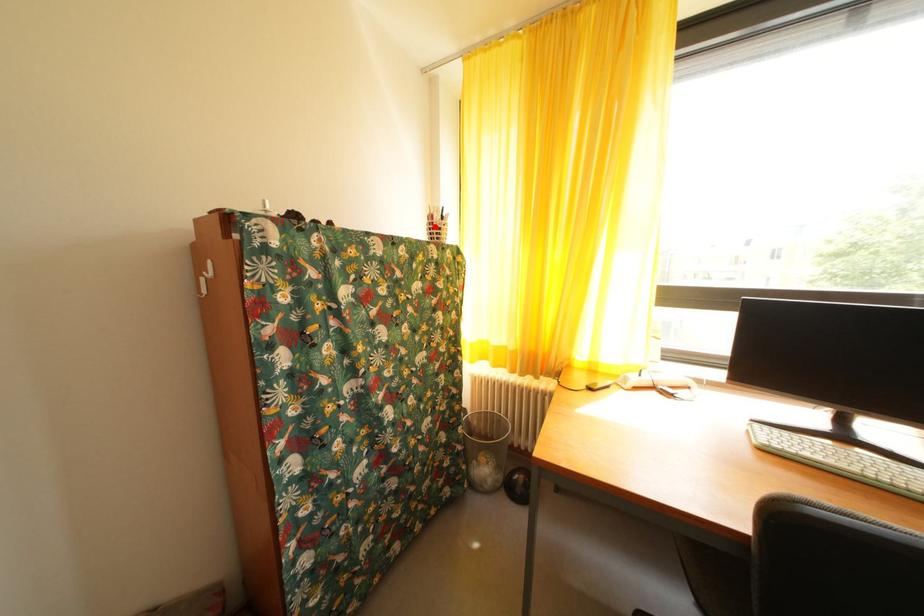
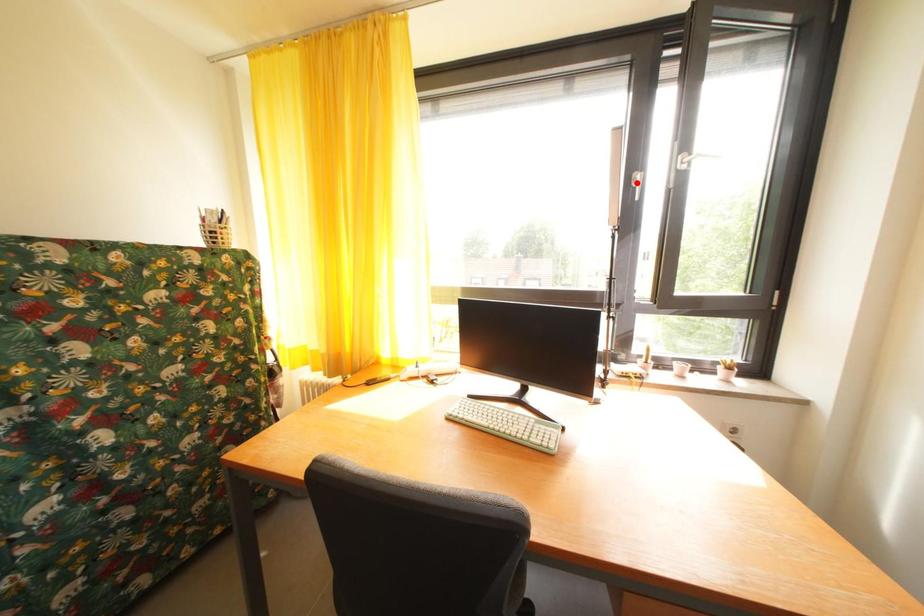
I am providing you with two images of the same scene from different viewpoints. A red point is marked on the first image and another point is marked on the second image. Does the point marked in image1 correspond to the same location as the one in image2?

No